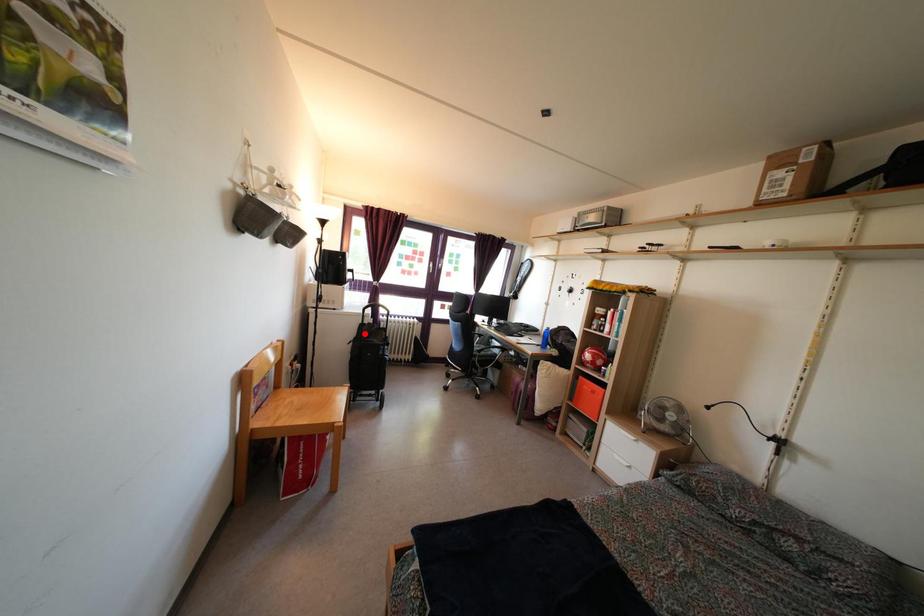
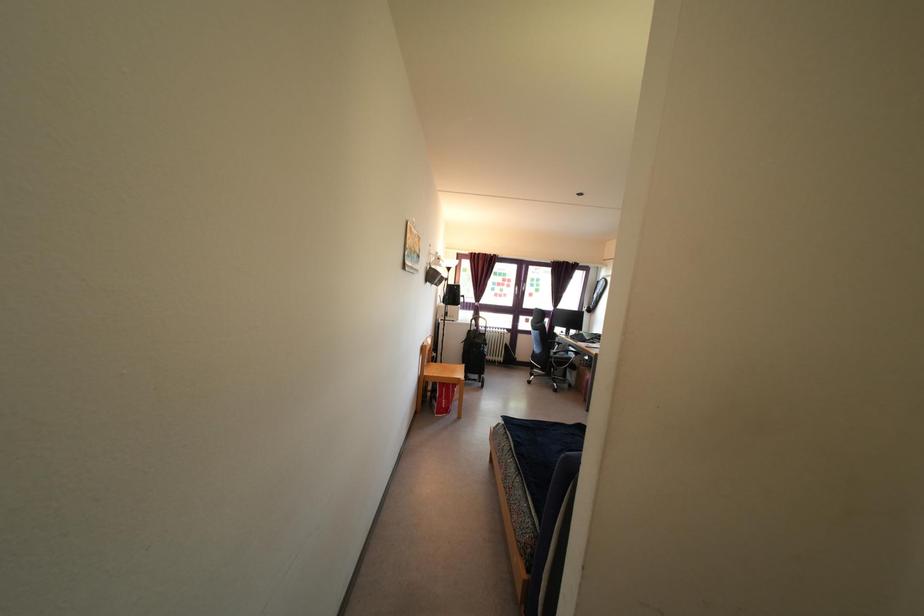
Question: I am providing you with two images of the same scene from different viewpoints. A red point is shown in image1. For the corresponding object point in image2, is it positioned nearer or farther from the camera?

Choices:
 (A) Nearer
 (B) Farther

Answer: (B)